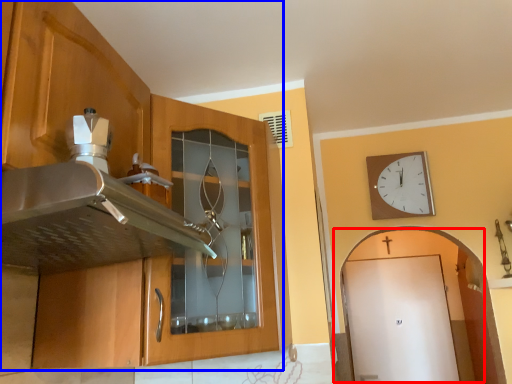
Question: Among these objects, which one is nearest to the camera, door (highlighted by a red box) or cabinetry (highlighted by a blue box)?

Choices:
 (A) door
 (B) cabinetry

Answer: (B)